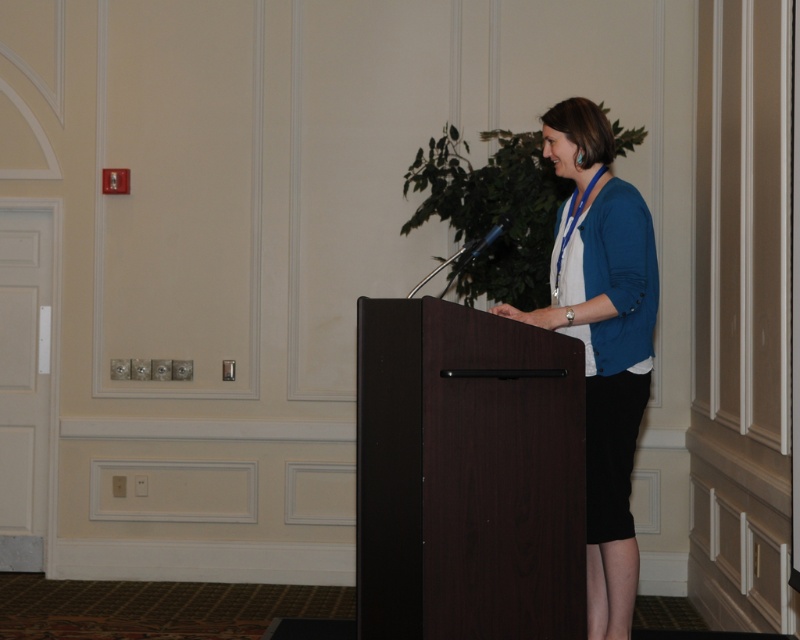
You are organizing a small event and need to place a 1.5 meter wide banner behind the dark wood podium at center and the blue fabric at center. Can the banner fit between them if they are positioned side by side?

The dark wood podium at center might be wider than blue fabric at center, so the total width of both items together could exceed 1.5 meters. Therefore, the banner may not fit between them if placed side by side.

What object is located at the coordinates point (x=466, y=476) in the image?

The point (x=466, y=476) indicates the dark wood podium at center.

You are an event organizer setting up the stage for a presentation. The woman at the podium needs to adjust her microphone so it doesn not block the view of the blue fabric backdrop. Based on the scene, is the microphone on the dark wood podium at center likely positioned above or below the blue fabric at center?

The dark wood podium at center is not as tall as blue fabric at center, so the microphone on the dark wood podium at center is likely positioned below the blue fabric at center.